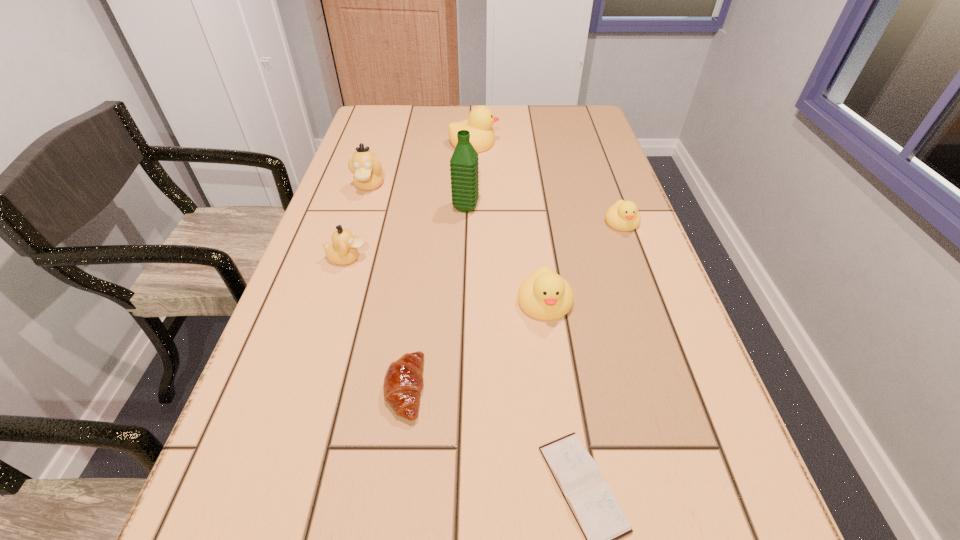
Find the location of a particular element. Image resolution: width=960 pixels, height=540 pixels. free point between the third shortest object and the seventh nearest object is located at coordinates (495, 204).

Where is `unoccupied position between the fourth nearest object and the second smallest yellow duckling`? The image size is (960, 540). unoccupied position between the fourth nearest object and the second smallest yellow duckling is located at coordinates (446, 280).

Find the location of `free area in between the crescent roll and the rightmost object`. free area in between the crescent roll and the rightmost object is located at coordinates (514, 306).

The width and height of the screenshot is (960, 540). I want to click on free spot between the second nearest duckling and the seventh tallest object, so click(x=376, y=323).

Identify which object is the third closest to the water bottle. Please provide its 2D coordinates. Your answer should be formatted as a tuple, i.e. [(x, y)], where the tuple contains the x and y coordinates of a point satisfying the conditions above.

[(481, 118)]

Choose which object is the third nearest neighbor to the nearest duckling. Please provide its 2D coordinates. Your answer should be formatted as a tuple, i.e. [(x, y)], where the tuple contains the x and y coordinates of a point satisfying the conditions above.

[(591, 500)]

Image resolution: width=960 pixels, height=540 pixels. Find the location of `duckling identified as the closest to the brown diary`. duckling identified as the closest to the brown diary is located at coordinates (544, 295).

The height and width of the screenshot is (540, 960). Find the location of `duckling identified as the second closest to the rightmost duckling`. duckling identified as the second closest to the rightmost duckling is located at coordinates (481, 118).

Select which yellow duckling is the third closest to the seventh nearest object. Please provide its 2D coordinates. Your answer should be formatted as a tuple, i.e. [(x, y)], where the tuple contains the x and y coordinates of a point satisfying the conditions above.

[(623, 215)]

Image resolution: width=960 pixels, height=540 pixels. Identify the location of the second closest yellow duckling relative to the brown crescent roll. [x=623, y=215].